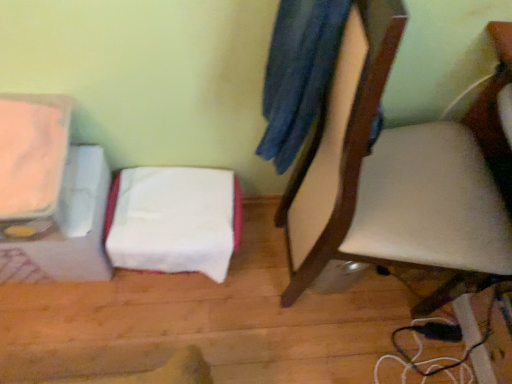
This screenshot has height=384, width=512. I want to click on white fabric at lower left, so click(173, 220).

Image resolution: width=512 pixels, height=384 pixels. What do you see at coordinates (173, 220) in the screenshot?
I see `white fabric at lower left` at bounding box center [173, 220].

What do you see at coordinates (50, 191) in the screenshot?
I see `matte orange toaster at left` at bounding box center [50, 191].

At what (x,y) coordinates should I click in order to perform the action: click on matte orange toaster at left. Please return your answer as a coordinate pair (x, y). Image resolution: width=512 pixels, height=384 pixels. Looking at the image, I should click on (50, 191).

The height and width of the screenshot is (384, 512). I want to click on white fabric at lower left, so click(173, 220).

From the picture: Can you confirm if white fabric at lower left is wider than white leather chair at center?

Incorrect, the width of white fabric at lower left does not surpass that of white leather chair at center.

Based on the photo, does white fabric at lower left appear on the right side of white leather chair at center?

No.

Where is `chair located on the right of white fabric at lower left`? The height and width of the screenshot is (384, 512). chair located on the right of white fabric at lower left is located at coordinates (390, 180).

From the image's perspective, is white leather chair at center above or below white fabric at lower left?

Based on their image positions, white leather chair at center is located above white fabric at lower left.

In terms of height, does white leather chair at center look taller or shorter compared to white fabric at lower left?

Clearly, white leather chair at center is taller compared to white fabric at lower left.

Would you say white leather chair at center is inside or outside white fabric at lower left?

white leather chair at center lies outside white fabric at lower left.

Is white leather chair at center in front of or behind white fabric at lower left in the image?

white leather chair at center is positioned closer to the viewer than white fabric at lower left.

Does matte orange toaster at left have a larger size compared to white leather chair at center?

Incorrect, matte orange toaster at left is not larger than white leather chair at center.

From the image's perspective, who appears lower, matte orange toaster at left or white leather chair at center?

white leather chair at center appears lower in the image.

Considering the relative sizes of matte orange toaster at left and white leather chair at center in the image provided, is matte orange toaster at left taller than white leather chair at center?

No, matte orange toaster at left is not taller than white leather chair at center.

Is white leather chair at center behind matte orange toaster at left?

No.

Which of these two, white leather chair at center or matte orange toaster at left, stands shorter?

Standing shorter between the two is matte orange toaster at left.

Does point (333, 186) appear closer or farther from the camera than point (54, 202)?

Clearly, point (333, 186) is more distant from the camera than point (54, 202).

Which of these two, white leather chair at center or matte orange toaster at left, is thinner?

matte orange toaster at left.

Identify the location of furniture on the left side of white fabric at lower left. This screenshot has width=512, height=384. (50, 191).

Considering the relative sizes of matte orange toaster at left and white fabric at lower left in the image provided, is matte orange toaster at left taller than white fabric at lower left?

No.

Considering the positions of objects matte orange toaster at left and white fabric at lower left in the image provided, who is more to the right, matte orange toaster at left or white fabric at lower left?

white fabric at lower left is more to the right.

Does matte orange toaster at left have a smaller size compared to white fabric at lower left?

Yes.

Looking at the image, does white fabric at lower left seem bigger or smaller compared to matte orange toaster at left?

white fabric at lower left is bigger than matte orange toaster at left.

Are white fabric at lower left and matte orange toaster at left beside each other?

There is a gap between white fabric at lower left and matte orange toaster at left.

Which is more to the left, white fabric at lower left or matte orange toaster at left?

matte orange toaster at left.

Locate an element on the screen. The image size is (512, 384). sheet that appears below the white leather chair at center (from a real-world perspective) is located at coordinates (173, 220).

The image size is (512, 384). Find the location of `chair in front of the white fabric at lower left`. chair in front of the white fabric at lower left is located at coordinates (390, 180).

Based on their spatial positions, is white fabric at lower left or matte orange toaster at left further from white leather chair at center?

Among the two, matte orange toaster at left is located further to white leather chair at center.

Based on their spatial positions, is matte orange toaster at left or white leather chair at center further from white fabric at lower left?

The object further to white fabric at lower left is white leather chair at center.

Which object lies nearer to the anchor point matte orange toaster at left, white fabric at lower left or white leather chair at center?

white fabric at lower left is positioned closer to the anchor matte orange toaster at left.

Looking at the image, which one is located closer to matte orange toaster at left, white leather chair at center or white fabric at lower left?

The object closer to matte orange toaster at left is white fabric at lower left.

When comparing their distances from white fabric at lower left, does white leather chair at center or matte orange toaster at left seem further?

Among the two, white leather chair at center is located further to white fabric at lower left.

Estimate the real-world distances between objects in this image. Which object is further from white leather chair at center, matte orange toaster at left or white fabric at lower left?

matte orange toaster at left lies further to white leather chair at center than the other object.

The image size is (512, 384). Identify the location of sheet between matte orange toaster at left and white leather chair at center in the horizontal direction. (173, 220).